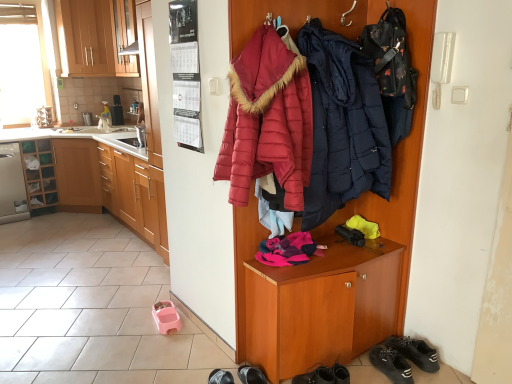
Question: Can you confirm if dark blue quilted jacket at center, arranged as the first jacket when viewed from the right, is shorter than quilted red jacket at center, which appears as the 2th jacket when viewed from the right?

Choices:
 (A) no
 (B) yes

Answer: (A)

Question: Is dark blue quilted jacket at center, arranged as the first jacket when viewed from the right, turned away from quilted red jacket at center, which appears as the 2th jacket when viewed from the right?

Choices:
 (A) yes
 (B) no

Answer: (B)

Question: Is dark blue quilted jacket at center, arranged as the first jacket when viewed from the right, not close to quilted red jacket at center, which appears as the 2th jacket when viewed from the right?

Choices:
 (A) yes
 (B) no

Answer: (B)

Question: Can you confirm if dark blue quilted jacket at center, the second jacket viewed from the left, is positioned to the right of quilted red jacket at center, which is counted as the 1th jacket, starting from the left?

Choices:
 (A) no
 (B) yes

Answer: (B)

Question: Is dark blue quilted jacket at center, the second jacket viewed from the left, positioned before quilted red jacket at center, which is counted as the 1th jacket, starting from the left?

Choices:
 (A) yes
 (B) no

Answer: (B)

Question: Does dark blue quilted jacket at center, arranged as the first jacket when viewed from the right, lie behind quilted red jacket at center, which appears as the 2th jacket when viewed from the right?

Choices:
 (A) no
 (B) yes

Answer: (B)

Question: From a real-world perspective, is dark blue quilted jacket at center, arranged as the first jacket when viewed from the right, beneath metallic stainless steel toaster at left?

Choices:
 (A) no
 (B) yes

Answer: (A)

Question: From the image's perspective, is dark blue quilted jacket at center, arranged as the first jacket when viewed from the right, beneath metallic stainless steel toaster at left?

Choices:
 (A) yes
 (B) no

Answer: (A)

Question: Does dark blue quilted jacket at center, arranged as the first jacket when viewed from the right, come behind metallic stainless steel toaster at left?

Choices:
 (A) yes
 (B) no

Answer: (B)

Question: Can you confirm if dark blue quilted jacket at center, the second jacket viewed from the left, is bigger than metallic stainless steel toaster at left?

Choices:
 (A) yes
 (B) no

Answer: (A)

Question: Is dark blue quilted jacket at center, the second jacket viewed from the left, at the right side of metallic stainless steel toaster at left?

Choices:
 (A) no
 (B) yes

Answer: (B)

Question: Does dark blue quilted jacket at center, arranged as the first jacket when viewed from the right, have a smaller size compared to metallic stainless steel toaster at left?

Choices:
 (A) no
 (B) yes

Answer: (A)

Question: Can black suede sneakers at lower right, which is the first footwear in right-to-left order, be found inside matte wood cabinets at upper left, positioned as the second cabinetry in left-to-right order?

Choices:
 (A) yes
 (B) no

Answer: (B)